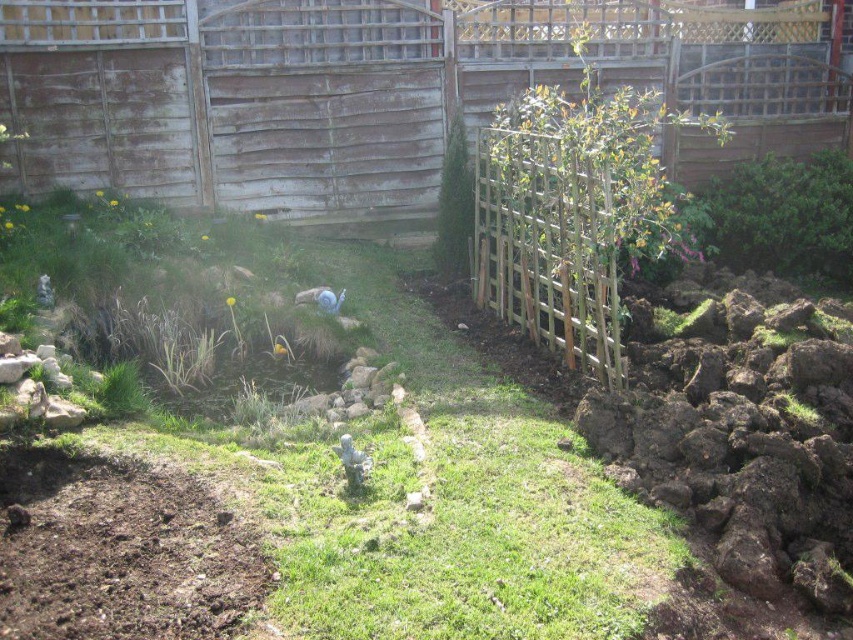
You are a gardener who needs to plant a new flower bed between the green grass at center and the weathered wood fence at upper center. The flower bed requires at least 10 feet of space. Do you have enough space to plant it?

The green grass at center is 11.77 feet from the weathered wood fence at upper center, which is more than the required 10 feet. Therefore, you have enough space to plant the flower bed between them.

You are a gardener who wants to mow the green grass at center. Can you mow it without hitting the weathered wood fence at upper center?

The green grass at center is shorter than the weathered wood fence at upper center, so yes, you can mow the green grass at center without hitting the fence because it is lower in height.